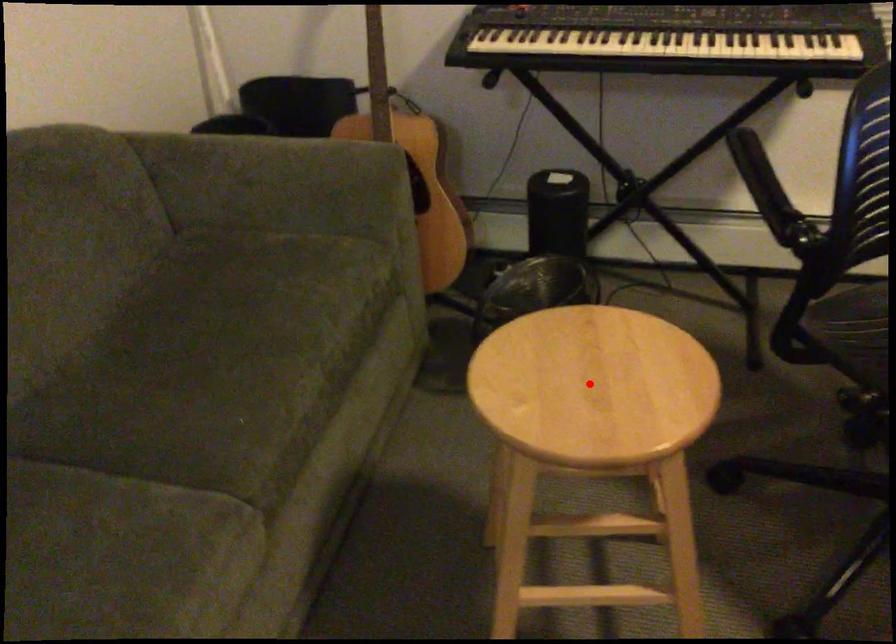
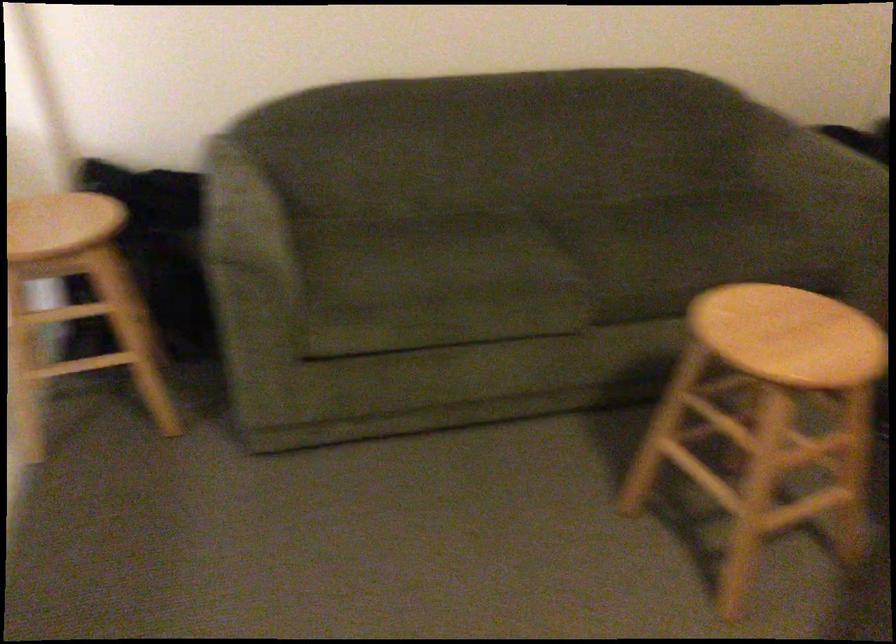
Locate, in the second image, the point that corresponds to the highlighted location in the first image.

(789, 335)